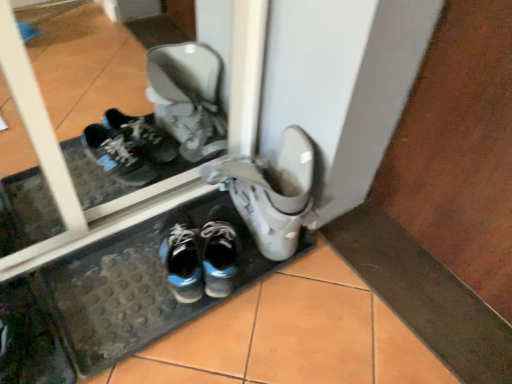
The width and height of the screenshot is (512, 384). What do you see at coordinates (182, 257) in the screenshot?
I see `shiny blue running shoe at center` at bounding box center [182, 257].

You are a GUI agent. You are given a task and a screenshot of the screen. Output one action in this format:
    pyautogui.click(x=<x>, y=<y>)
    Task: Click on the blue synthetic sneakers at center, positioned as the 2th footwear in right-to-left order
    This screenshot has width=512, height=384.
    Given the screenshot: What is the action you would take?
    pyautogui.click(x=220, y=252)

Between blue synthetic sneakers at center, which is counted as the first footwear, starting from the left, and white matte boot at center, which is counted as the first footwear, starting from the right, which one has smaller size?

blue synthetic sneakers at center, which is counted as the first footwear, starting from the left.

Does point (210, 212) lie behind point (284, 192)?

Yes, point (210, 212) is behind point (284, 192).

From a real-world perspective, is blue synthetic sneakers at center, positioned as the 2th footwear in right-to-left order, on top of white matte boot at center, the 2th footwear viewed from the left?

Incorrect, from a real-world perspective, blue synthetic sneakers at center, positioned as the 2th footwear in right-to-left order, is lower than white matte boot at center, the 2th footwear viewed from the left.

In the scene shown: Considering the relative sizes of shiny blue running shoe at center and white matte boot at center, which is counted as the first footwear, starting from the right, in the image provided, is shiny blue running shoe at center wider than white matte boot at center, which is counted as the first footwear, starting from the right,?

In fact, shiny blue running shoe at center might be narrower than white matte boot at center, which is counted as the first footwear, starting from the right.

Considering the sizes of shiny blue running shoe at center and white matte boot at center, which is counted as the first footwear, starting from the right, in the image, is shiny blue running shoe at center bigger or smaller than white matte boot at center, which is counted as the first footwear, starting from the right,?

Clearly, shiny blue running shoe at center is smaller in size than white matte boot at center, which is counted as the first footwear, starting from the right.

Does shiny blue running shoe at center come behind white matte boot at center, which is counted as the first footwear, starting from the right?

Yes, the depth of shiny blue running shoe at center is greater than that of white matte boot at center, which is counted as the first footwear, starting from the right.

Which point is more distant from viewer, (198,235) or (307,199)?

Positioned behind is point (198,235).

Between shiny blue running shoe at center and blue synthetic sneakers at center, positioned as the 2th footwear in right-to-left order, which one appears on the left side from the viewer's perspective?

From the viewer's perspective, shiny blue running shoe at center appears more on the left side.

Can you tell me how much shiny blue running shoe at center and blue synthetic sneakers at center, which is counted as the first footwear, starting from the left, differ in facing direction?

shiny blue running shoe at center and blue synthetic sneakers at center, which is counted as the first footwear, starting from the left, are facing 6.03 degrees away from each other.

Measure the distance between shiny blue running shoe at center and blue synthetic sneakers at center, which is counted as the first footwear, starting from the left.

shiny blue running shoe at center is 2.55 inches away from blue synthetic sneakers at center, which is counted as the first footwear, starting from the left.

Is shiny blue running shoe at center next to blue synthetic sneakers at center, which is counted as the first footwear, starting from the left, and touching it?

Yes, shiny blue running shoe at center is touching blue synthetic sneakers at center, which is counted as the first footwear, starting from the left.

You are a GUI agent. You are given a task and a screenshot of the screen. Output one action in this format:
    pyautogui.click(x=<x>, y=<y>)
    Task: Click on the footwear lying behind the shiny blue running shoe at center
    The image size is (512, 384).
    Given the screenshot: What is the action you would take?
    pyautogui.click(x=220, y=252)

Consider the image. Is blue synthetic sneakers at center, which is counted as the first footwear, starting from the left, oriented towards shiny blue running shoe at center?

No, blue synthetic sneakers at center, which is counted as the first footwear, starting from the left, is not turned towards shiny blue running shoe at center.

Considering the positions of objects blue synthetic sneakers at center, positioned as the 2th footwear in right-to-left order, and shiny blue running shoe at center in the image provided, who is in front, blue synthetic sneakers at center, positioned as the 2th footwear in right-to-left order, or shiny blue running shoe at center?

Positioned in front is shiny blue running shoe at center.

From the image's perspective, is white matte boot at center, the 2th footwear viewed from the left, on blue synthetic sneakers at center, which is counted as the first footwear, starting from the left?

Yes, from the image's perspective, white matte boot at center, the 2th footwear viewed from the left, is on top of blue synthetic sneakers at center, which is counted as the first footwear, starting from the left.

Which is correct: white matte boot at center, which is counted as the first footwear, starting from the right, is inside blue synthetic sneakers at center, positioned as the 2th footwear in right-to-left order, or outside of it?

white matte boot at center, which is counted as the first footwear, starting from the right, exists outside the volume of blue synthetic sneakers at center, positioned as the 2th footwear in right-to-left order.

Is white matte boot at center, the 2th footwear viewed from the left, oriented away from blue synthetic sneakers at center, which is counted as the first footwear, starting from the left?

No, white matte boot at center, the 2th footwear viewed from the left, is not facing the opposite direction of blue synthetic sneakers at center, which is counted as the first footwear, starting from the left.

Looking at their sizes, would you say white matte boot at center, the 2th footwear viewed from the left, is wider or thinner than blue synthetic sneakers at center, which is counted as the first footwear, starting from the left?

white matte boot at center, the 2th footwear viewed from the left, is wider than blue synthetic sneakers at center, which is counted as the first footwear, starting from the left.

The image size is (512, 384). I want to click on running shoe that is behind the white matte boot at center, the 2th footwear viewed from the left, so click(182, 257).

Considering the positions of objects white matte boot at center, the 2th footwear viewed from the left, and shiny blue running shoe at center in the image provided, who is behind, white matte boot at center, the 2th footwear viewed from the left, or shiny blue running shoe at center?

shiny blue running shoe at center is behind.

Which of these two, white matte boot at center, which is counted as the first footwear, starting from the right, or shiny blue running shoe at center, stands taller?

white matte boot at center, which is counted as the first footwear, starting from the right.

Locate an element on the screen. footwear on the left of the white matte boot at center, which is counted as the first footwear, starting from the right is located at coordinates (220, 252).

Image resolution: width=512 pixels, height=384 pixels. Find the location of `the 2nd footwear counting from the right side of the shiny blue running shoe at center`. the 2nd footwear counting from the right side of the shiny blue running shoe at center is located at coordinates click(x=271, y=192).

When comparing their distances from shiny blue running shoe at center, does blue synthetic sneakers at center, positioned as the 2th footwear in right-to-left order, or white matte boot at center, the 2th footwear viewed from the left, seem further?

white matte boot at center, the 2th footwear viewed from the left, is positioned further to the anchor shiny blue running shoe at center.

From the image, which object appears to be farther from blue synthetic sneakers at center, which is counted as the first footwear, starting from the left, white matte boot at center, the 2th footwear viewed from the left, or shiny blue running shoe at center?

white matte boot at center, the 2th footwear viewed from the left, is positioned further to the anchor blue synthetic sneakers at center, which is counted as the first footwear, starting from the left.

Estimate the real-world distances between objects in this image. Which object is closer to white matte boot at center, which is counted as the first footwear, starting from the right, shiny blue running shoe at center or blue synthetic sneakers at center, positioned as the 2th footwear in right-to-left order?

→ blue synthetic sneakers at center, positioned as the 2th footwear in right-to-left order.

Looking at the image, which one is located closer to white matte boot at center, the 2th footwear viewed from the left, blue synthetic sneakers at center, positioned as the 2th footwear in right-to-left order, or shiny blue running shoe at center?

blue synthetic sneakers at center, positioned as the 2th footwear in right-to-left order, is positioned closer to the anchor white matte boot at center, the 2th footwear viewed from the left.

Estimate the real-world distances between objects in this image. Which object is further from blue synthetic sneakers at center, which is counted as the first footwear, starting from the left, shiny blue running shoe at center or white matte boot at center, which is counted as the first footwear, starting from the right?

white matte boot at center, which is counted as the first footwear, starting from the right, is further to blue synthetic sneakers at center, which is counted as the first footwear, starting from the left.

From the image, which object appears to be farther from shiny blue running shoe at center, white matte boot at center, which is counted as the first footwear, starting from the right, or blue synthetic sneakers at center, which is counted as the first footwear, starting from the left?

The object further to shiny blue running shoe at center is white matte boot at center, which is counted as the first footwear, starting from the right.

You are a GUI agent. You are given a task and a screenshot of the screen. Output one action in this format:
    pyautogui.click(x=<x>, y=<y>)
    Task: Click on the footwear between shiny blue running shoe at center and white matte boot at center, the 2th footwear viewed from the left, from left to right
    Image resolution: width=512 pixels, height=384 pixels.
    Given the screenshot: What is the action you would take?
    pyautogui.click(x=220, y=252)